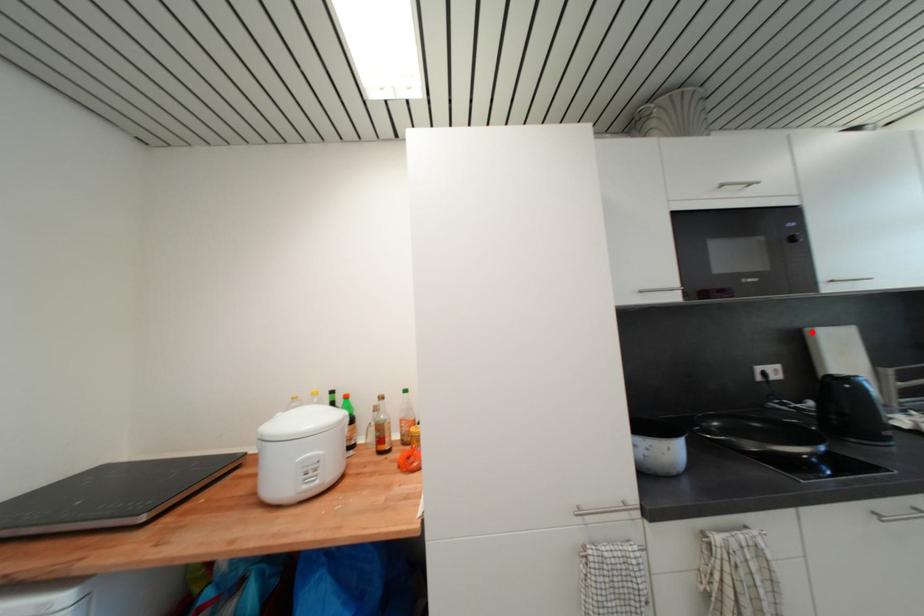
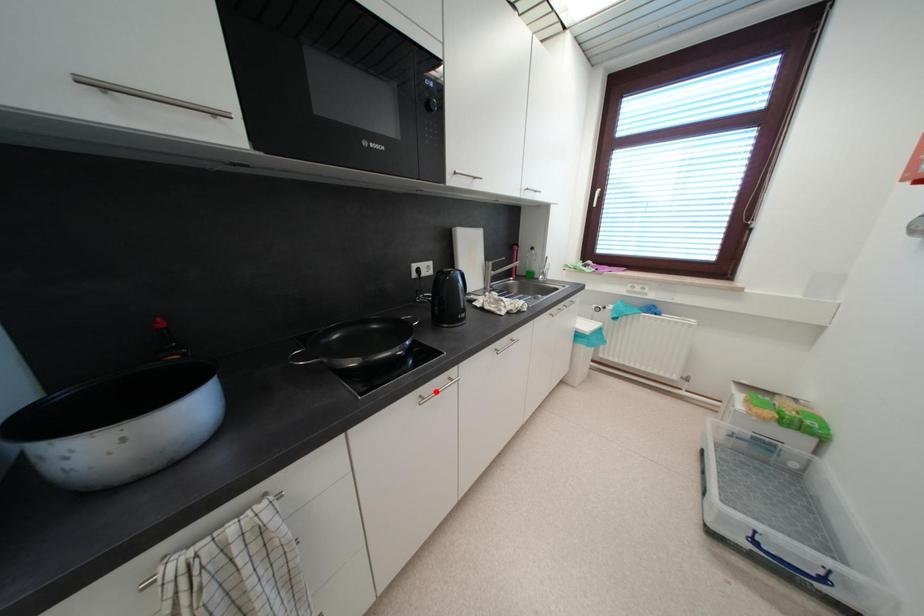
I am providing you with two images of the same scene from different viewpoints. A red point is marked on the first image and another point is marked on the second image. Does the point marked in image1 correspond to the same location as the one in image2?

No